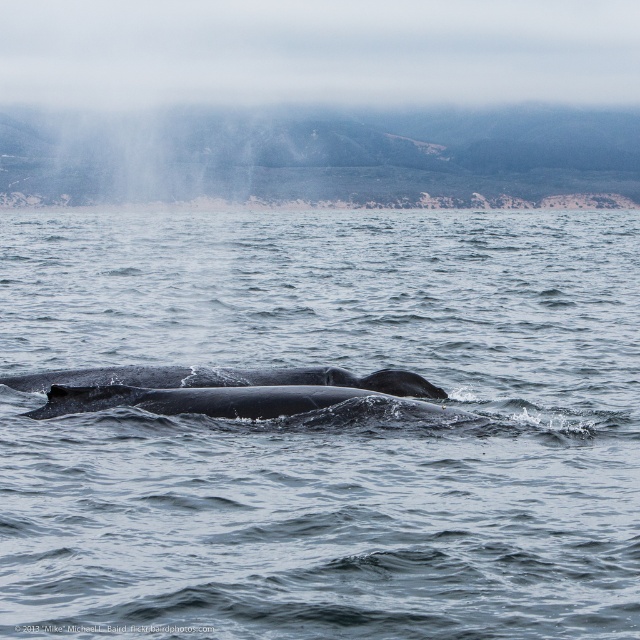
Question: Does gray matte water at center have a greater width compared to gray matte whale at center?

Choices:
 (A) yes
 (B) no

Answer: (A)

Question: Where is gray matte water at center located in relation to gray matte whale at center in the image?

Choices:
 (A) above
 (B) below

Answer: (A)

Question: Which point is farther from the camera taking this photo?

Choices:
 (A) (291, 371)
 (B) (474, 282)

Answer: (B)

Question: Which object appears farthest from the camera in this image?

Choices:
 (A) gray matte water at center
 (B) gray matte whale at center

Answer: (B)

Question: Which point is closer to the camera taking this photo?

Choices:
 (A) (161, 369)
 (B) (308, 497)

Answer: (B)

Question: Where is gray matte water at center located in relation to gray matte whale at center in the image?

Choices:
 (A) above
 (B) below

Answer: (A)